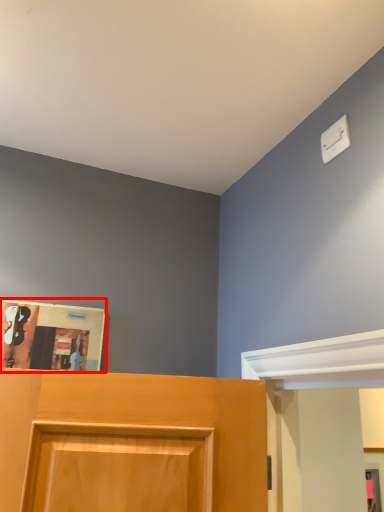
Question: From the image's perspective, considering the relative positions of magazine (annotated by the red box) and light switch in the image provided, where is magazine (annotated by the red box) located with respect to the staircase?

Choices:
 (A) above
 (B) below

Answer: (B)